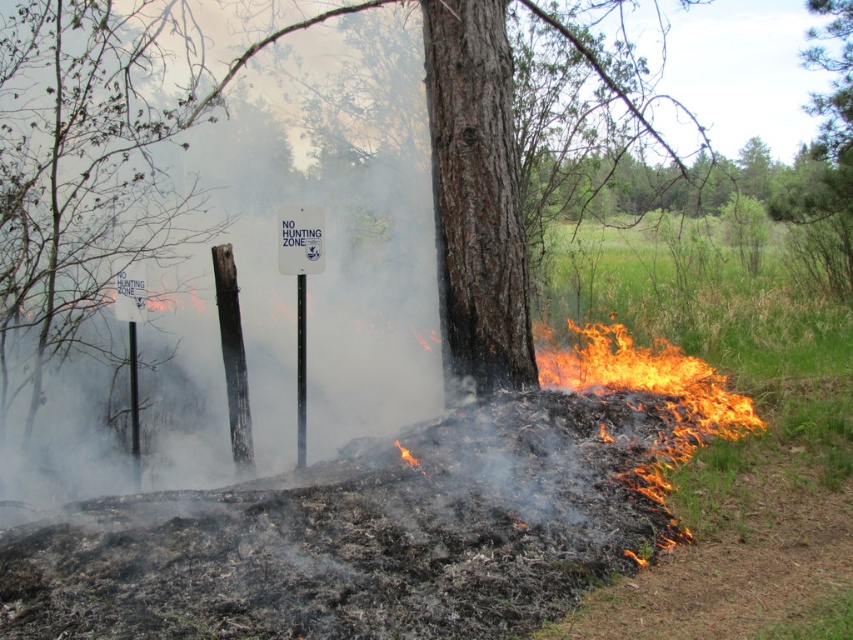
Question: Which of the following is the closest to the observer?

Choices:
 (A) smooth wooden pole at center
 (B) charcoal textured post at center

Answer: (A)

Question: Can you confirm if charcoal textured post at center is positioned below flame at lower center?

Choices:
 (A) yes
 (B) no

Answer: (B)

Question: Considering the relative positions of flame at lower right and smooth wooden pole at center in the image provided, where is flame at lower right located with respect to smooth wooden pole at center?

Choices:
 (A) above
 (B) below

Answer: (A)

Question: Among these objects, which one is farthest from the camera?

Choices:
 (A) flame at lower center
 (B) smooth wooden pole at center
 (C) flame at lower right

Answer: (B)

Question: Considering the relative positions of flame at lower right and charcoal textured post at center in the image provided, where is flame at lower right located with respect to charcoal textured post at center?

Choices:
 (A) below
 (B) above

Answer: (A)

Question: Which is nearer to the flame at lower right?

Choices:
 (A) black plastic pole at center
 (B) flame at lower center

Answer: (B)